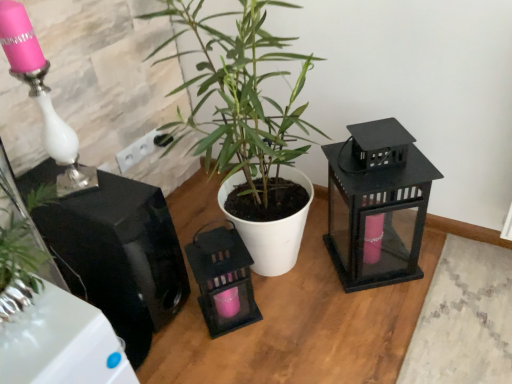
This screenshot has width=512, height=384. Find the location of `vacant space underneath matte black lantern at right, acting as the first appliance starting from the right (from a real-world perspective)`. vacant space underneath matte black lantern at right, acting as the first appliance starting from the right (from a real-world perspective) is located at coordinates (371, 262).